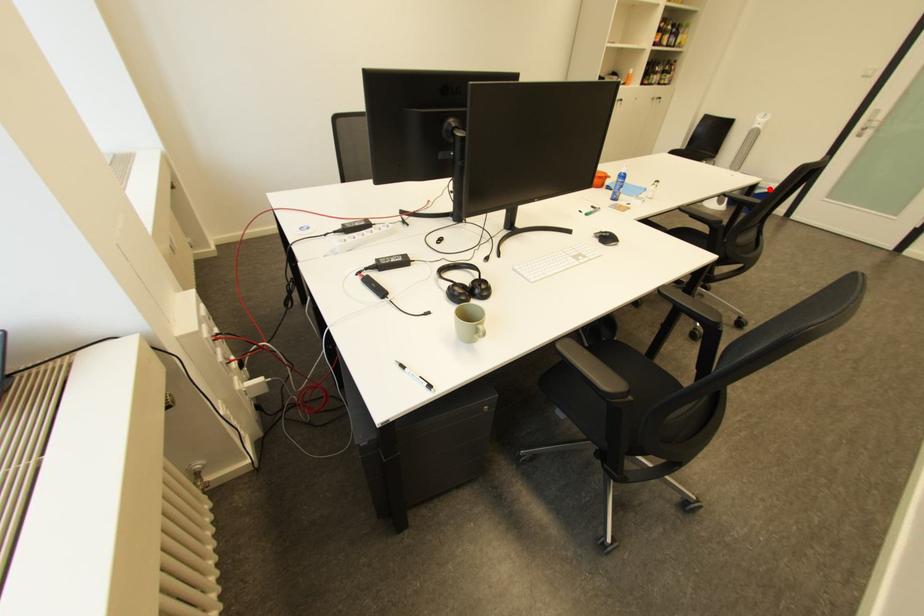
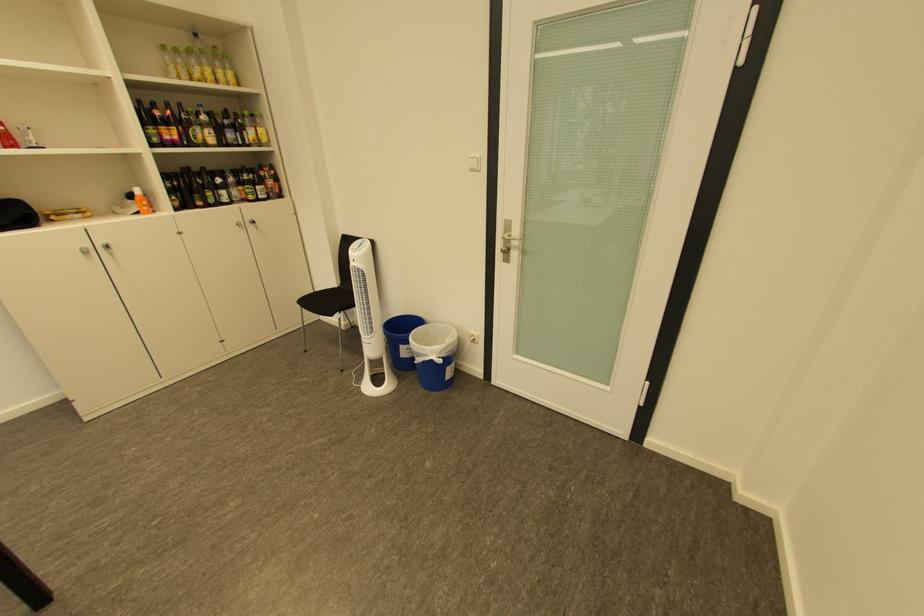
Find the pixel in the second image that matches the highlighted location in the first image.

(429, 355)